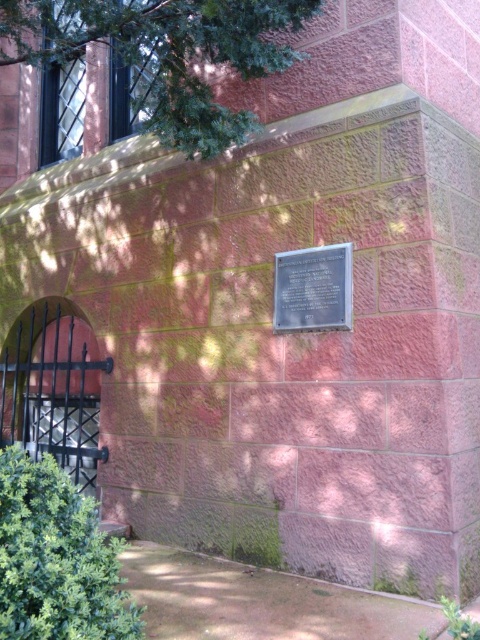
Find the location of a particular element. green leafy bush at lower left is located at coordinates (57, 560).

Looking at this image, who is lower down, green leafy bush at lower left or metallic plaque at center?

Positioned lower is green leafy bush at lower left.

At what (x,y) coordinates should I click in order to perform the action: click on green leafy bush at lower left. Please return your answer as a coordinate pair (x, y). This screenshot has height=640, width=480. Looking at the image, I should click on (57, 560).

Does green leafy tree at upper left have a greater height compared to metallic plaque at center?

Correct, green leafy tree at upper left is much taller as metallic plaque at center.

Is green leafy tree at upper left above metallic plaque at center?

Correct, green leafy tree at upper left is located above metallic plaque at center.

Describe the element at coordinates (165, 52) in the screenshot. I see `green leafy tree at upper left` at that location.

Image resolution: width=480 pixels, height=640 pixels. Identify the location of green leafy tree at upper left. (165, 52).

Is green leafy tree at upper left wider than green leafy bush at lower left?

Correct, the width of green leafy tree at upper left exceeds that of green leafy bush at lower left.

Measure the distance between point (211, 97) and camera.

Point (211, 97) and camera are 3.72 meters apart from each other.

Does point (252, 51) come closer to viewer compared to point (52, 593)?

No, it is not.

At what (x,y) coordinates should I click in order to perform the action: click on green leafy tree at upper left. Please return your answer as a coordinate pair (x, y). The width and height of the screenshot is (480, 640). Looking at the image, I should click on (165, 52).